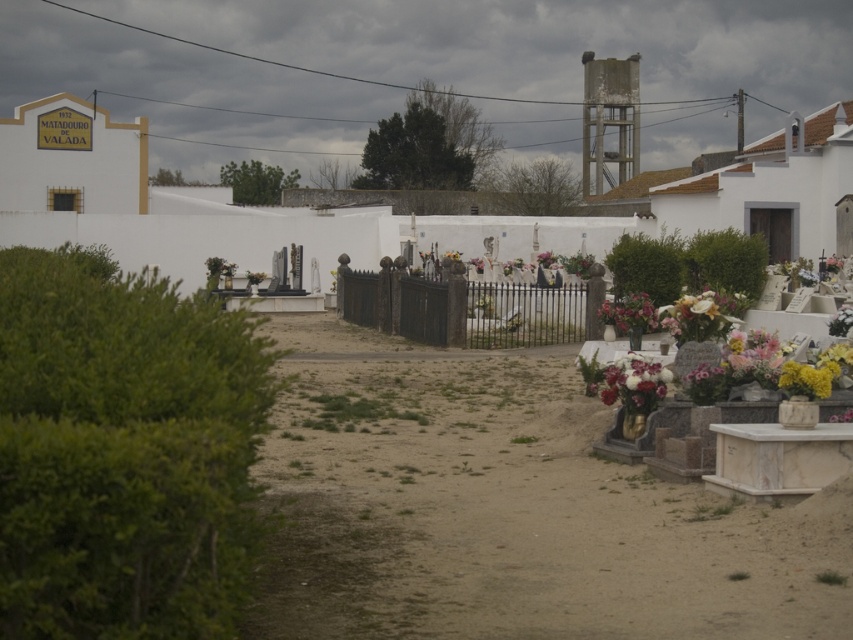
Question: Can you confirm if yellow lily at right is positioned to the right of white floral bouquet at lower right?

Choices:
 (A) no
 (B) yes

Answer: (B)

Question: Among these objects, which one is nearest to the camera?

Choices:
 (A) white floral bouquet at lower right
 (B) floral bouquet at center-right

Answer: (A)

Question: Is floral bouquet at right above floral bouquet at center-right?

Choices:
 (A) no
 (B) yes

Answer: (A)

Question: Which point is farther to the camera?

Choices:
 (A) yellow lily at right
 (B) floral bouquet at right
 (C) floral bouquet at center-right

Answer: (C)

Question: Which point is closer to the camera?

Choices:
 (A) (646, 307)
 (B) (660, 372)
 (C) (711, 294)

Answer: (B)

Question: Is black wrought iron fence at center above white floral bouquet at lower right?

Choices:
 (A) yes
 (B) no

Answer: (A)